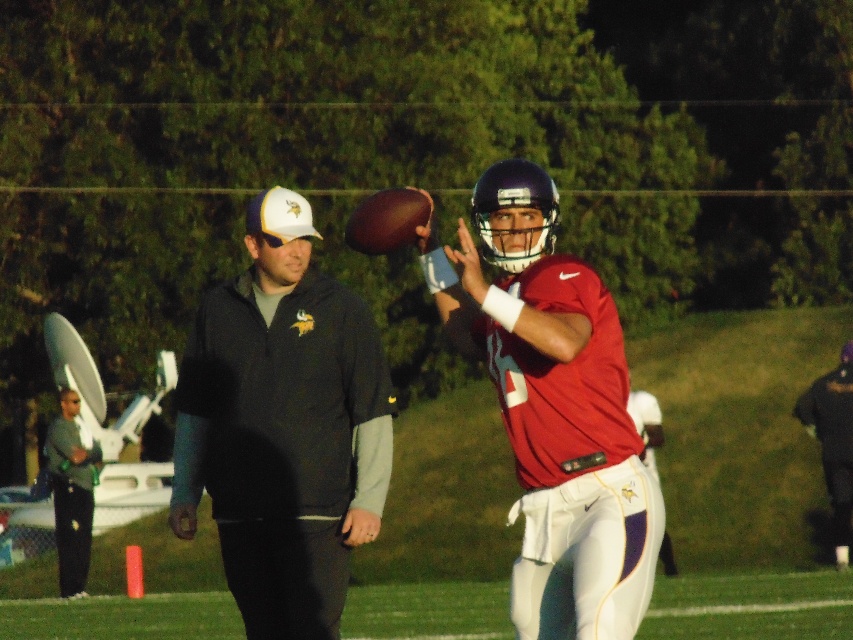
In the scene shown: You are a photographer positioned at the origin point of the image coordinate system. You need to capture a closeup shot of the matte red jersey at center. What are the exact coordinates where you should aim your camera?

The exact coordinates to aim your camera are at point (554,410).

You are a photographer taking a picture of the nighttime football practice. You notice two points in the image at coordinates point (515, 337) and point (833, 384). Which point is closer to your camera?

Point (515, 337) is closer to the viewer than point (833, 384).